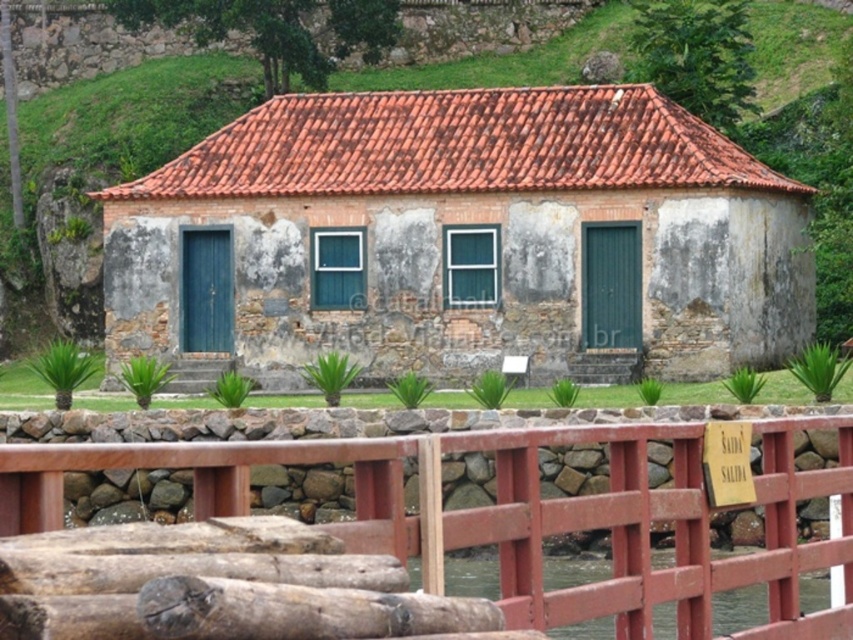
You are planning to place a new garden bench between the stone textured hut at center and the wooden fence at lower center. Considering their widths, which object should be closer to the bench to ensure there is enough space?

The stone textured hut at center has a larger width than the wooden fence at lower center, so placing the bench closer to the wooden fence at lower center would leave more space between them.